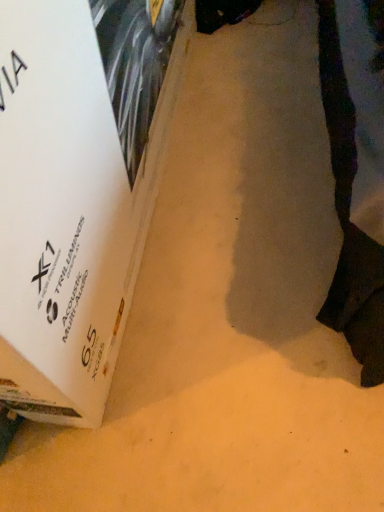
Locate an element on the screen. This screenshot has width=384, height=512. space that is in front of white cardboard box at lower left is located at coordinates (210, 354).